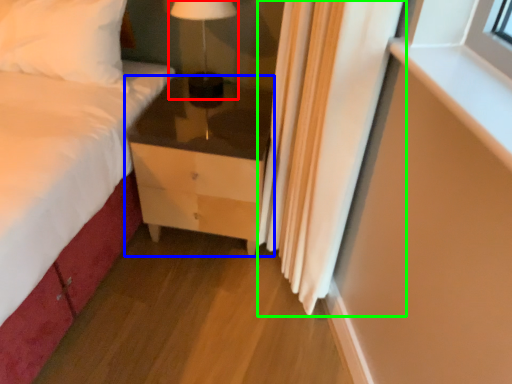
Question: Based on their relative distances, which object is nearer to table lamp (highlighted by a red box)? Choose from chest of drawers (highlighted by a blue box) and curtain (highlighted by a green box).

Choices:
 (A) chest of drawers
 (B) curtain

Answer: (A)